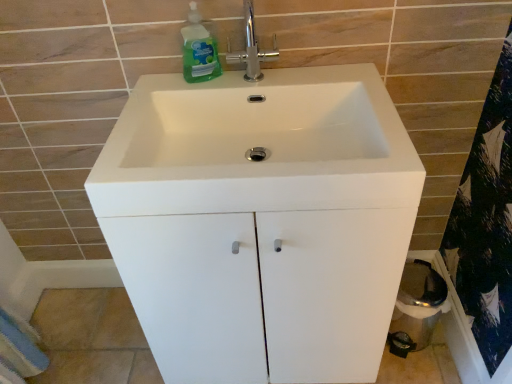
You are a GUI agent. You are given a task and a screenshot of the screen. Output one action in this format:
    pyautogui.click(x=<x>, y=<y>)
    Task: Click on the free spot to the right of green translucent liquid at upper left
    The image size is (512, 384).
    Given the screenshot: What is the action you would take?
    pyautogui.click(x=280, y=87)